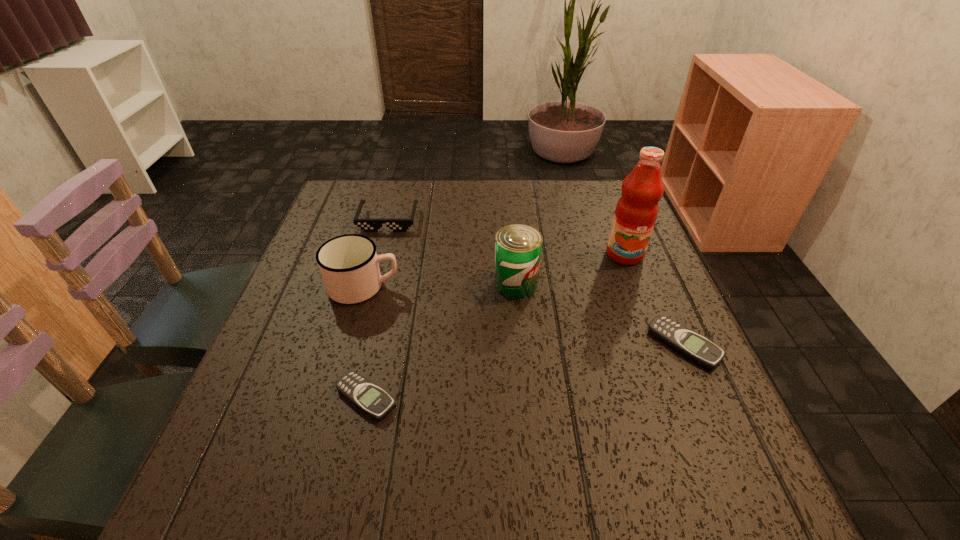
The image size is (960, 540). I want to click on the nearest object, so click(x=367, y=396).

Image resolution: width=960 pixels, height=540 pixels. Find the location of `the shorter beeper`. the shorter beeper is located at coordinates (367, 396).

I want to click on the right beeper, so click(x=688, y=343).

This screenshot has width=960, height=540. I want to click on the taller beeper, so click(x=688, y=343).

Find the location of `the third shortest object`. the third shortest object is located at coordinates (368, 225).

I want to click on the farthest object, so click(368, 225).

Locate an element on the screen. This screenshot has height=540, width=960. mug is located at coordinates (349, 266).

I want to click on the fifth nearest object, so click(x=636, y=211).

Find the location of `fruit juice`. fruit juice is located at coordinates (636, 211).

Where is `the third object from right to left`? the third object from right to left is located at coordinates (518, 247).